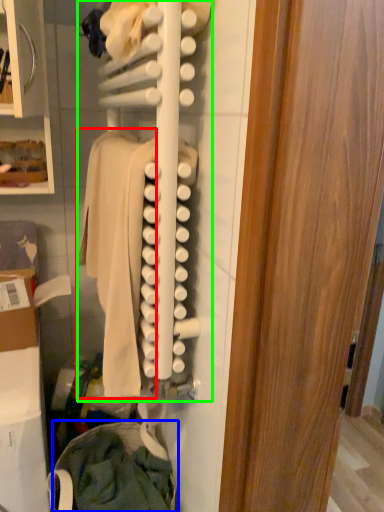
Question: Which object is positioned closest to clothing (highlighted by a red box)? Select from clothing (highlighted by a blue box) and closet (highlighted by a green box).

Choices:
 (A) clothing
 (B) closet

Answer: (B)